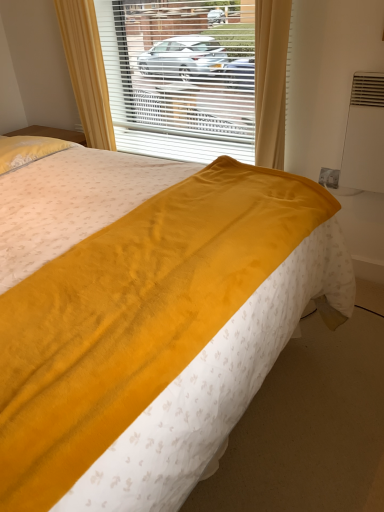
Question: Considering the relative sizes of white plastic blinds at center and velvet yellow blanket at center in the image provided, is white plastic blinds at center wider than velvet yellow blanket at center?

Choices:
 (A) yes
 (B) no

Answer: (B)

Question: Is white plastic blinds at center positioned with its back to velvet yellow blanket at center?

Choices:
 (A) no
 (B) yes

Answer: (A)

Question: Is white plastic blinds at center positioned in front of velvet yellow blanket at center?

Choices:
 (A) no
 (B) yes

Answer: (A)

Question: From a real-world perspective, is white plastic blinds at center located beneath velvet yellow blanket at center?

Choices:
 (A) yes
 (B) no

Answer: (B)

Question: Is white plastic blinds at center smaller than velvet yellow blanket at center?

Choices:
 (A) yes
 (B) no

Answer: (A)

Question: Does white plastic blinds at center have a lesser width compared to velvet yellow blanket at center?

Choices:
 (A) yes
 (B) no

Answer: (A)

Question: Considering the relative sizes of velvet yellow blanket at center and white plastic blinds at center in the image provided, is velvet yellow blanket at center taller than white plastic blinds at center?

Choices:
 (A) yes
 (B) no

Answer: (A)

Question: Is velvet yellow blanket at center far from white plastic blinds at center?

Choices:
 (A) no
 (B) yes

Answer: (B)

Question: Is velvet yellow blanket at center outside of white plastic blinds at center?

Choices:
 (A) yes
 (B) no

Answer: (A)

Question: Can you confirm if velvet yellow blanket at center is thinner than white plastic blinds at center?

Choices:
 (A) yes
 (B) no

Answer: (B)

Question: Is velvet yellow blanket at center next to white plastic blinds at center?

Choices:
 (A) yes
 (B) no

Answer: (B)

Question: Is velvet yellow blanket at center oriented away from white plastic blinds at center?

Choices:
 (A) no
 (B) yes

Answer: (A)

Question: From a real-world perspective, is velvet yellow blanket at center physically located above or below white plastic blinds at center?

Choices:
 (A) above
 (B) below

Answer: (B)